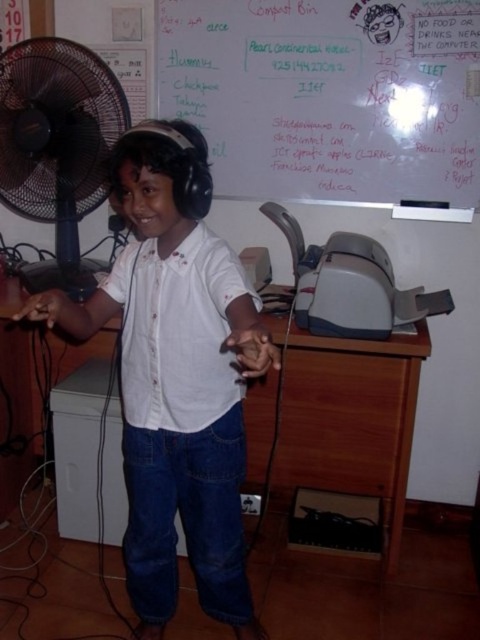
Is point (131, 172) positioned in front of point (39, 173)?

Yes, it is in front of point (39, 173).

Is white matte shirt at center to the left of black plastic fan at left from the viewer's perspective?

Incorrect, white matte shirt at center is not on the left side of black plastic fan at left.

Is point (172, 444) positioned after point (74, 212)?

No, (172, 444) is closer to viewer.

You are a GUI agent. You are given a task and a screenshot of the screen. Output one action in this format:
    pyautogui.click(x=<x>, y=<y>)
    Task: Click on the white matte shirt at center
    
    Given the screenshot: What is the action you would take?
    pyautogui.click(x=177, y=376)

Looking at this image, between wooden at center and black plastic fan at left, which one is positioned lower?

wooden at center is lower down.

Who is shorter, wooden at center or black plastic fan at left?

With less height is wooden at center.

Between point (369, 472) and point (108, 116), which one is positioned in front?

Positioned in front is point (108, 116).

Find the location of `wooden at center`. wooden at center is located at coordinates (349, 417).

Can you confirm if white matte shirt at center is thinner than wooden at center?

Indeed, white matte shirt at center has a lesser width compared to wooden at center.

At what (x,y) coordinates should I click in order to perform the action: click on white matte shirt at center. Please return your answer as a coordinate pair (x, y). The image size is (480, 640). Looking at the image, I should click on (177, 376).

Does point (232, 572) lie in front of point (383, 493)?

That is True.

Locate an element on the screen. white matte shirt at center is located at coordinates (177, 376).